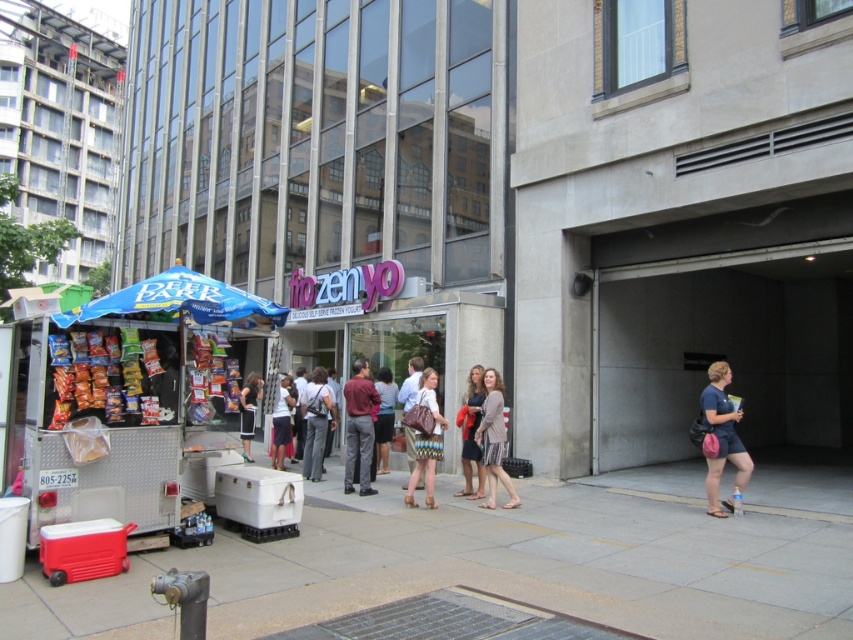
Does blue fabric canopy at left come behind light brown fabric dress at center?

No, it is not.

The height and width of the screenshot is (640, 853). In order to click on blue fabric canopy at left in this screenshot , I will do `click(178, 300)`.

Does point (151, 280) lie in front of point (486, 468)?

Yes, point (151, 280) is closer to viewer.

This screenshot has width=853, height=640. In order to click on blue fabric canopy at left in this screenshot , I will do `click(178, 300)`.

Can you confirm if blue fabric canopy at left is shorter than black fabric shorts at center?

In fact, blue fabric canopy at left may be taller than black fabric shorts at center.

Does blue fabric canopy at left have a larger size compared to black fabric shorts at center?

Yes, blue fabric canopy at left is bigger than black fabric shorts at center.

You are a GUI agent. You are given a task and a screenshot of the screen. Output one action in this format:
    pyautogui.click(x=<x>, y=<y>)
    Task: Click on the blue fabric canopy at left
    
    Given the screenshot: What is the action you would take?
    [178, 300]

How far apart are metallic silver food truck at left and black fabric shorts at center?

A distance of 7.20 meters exists between metallic silver food truck at left and black fabric shorts at center.

Between point (202, 451) and point (252, 426), which one is positioned behind?

Point (252, 426)

At what (x,y) coordinates should I click in order to perform the action: click on metallic silver food truck at left. Please return your answer as a coordinate pair (x, y). Looking at the image, I should click on (125, 396).